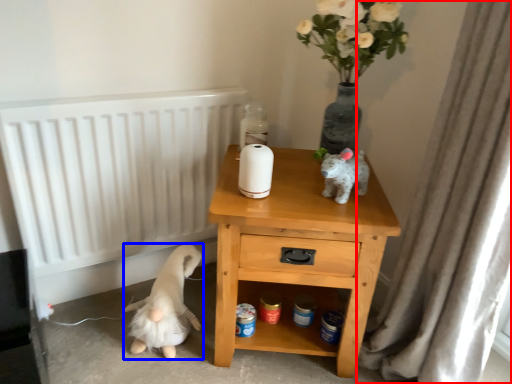
Question: Which object appears farthest to the camera in this image, curtain (highlighted by a red box) or animal (highlighted by a blue box)?

Choices:
 (A) curtain
 (B) animal

Answer: (B)